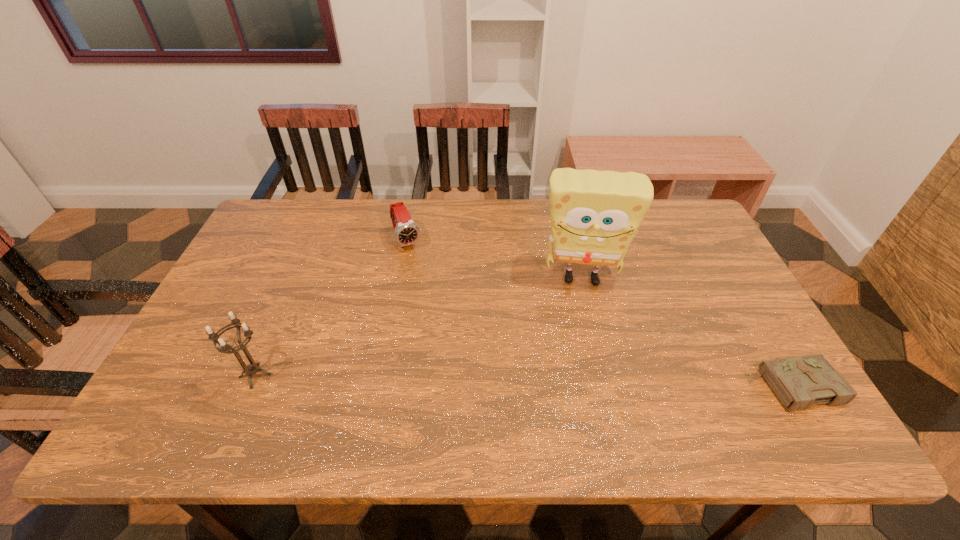
Image resolution: width=960 pixels, height=540 pixels. What are the coordinates of `candle holder` in the screenshot? It's located at (251, 369).

Image resolution: width=960 pixels, height=540 pixels. I want to click on the leftmost object, so click(251, 369).

Locate an element on the screen. diary is located at coordinates (798, 382).

At what (x,y) coordinates should I click in order to perform the action: click on the rightmost object. Please return your answer as a coordinate pair (x, y). This screenshot has height=540, width=960. Looking at the image, I should click on (798, 382).

Where is `the second farthest object`? the second farthest object is located at coordinates (594, 216).

Where is `the third object from left to right`? Image resolution: width=960 pixels, height=540 pixels. the third object from left to right is located at coordinates (594, 216).

This screenshot has height=540, width=960. I want to click on watch, so click(x=406, y=232).

Find the location of a particular element. This screenshot has width=960, height=540. the third object from right to left is located at coordinates (406, 232).

In order to click on vacant space located 0.300m on the back of the second tallest object in this screenshot , I will do `click(298, 275)`.

Find the location of a particular element. The image size is (960, 540). vacant space located 0.240m on the face of the third nearest object is located at coordinates (584, 366).